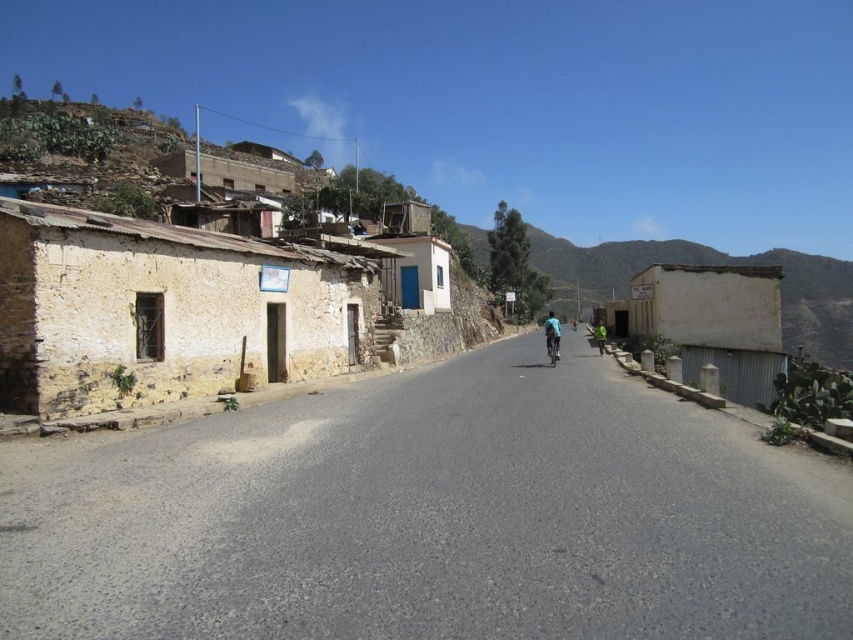
Question: Considering the real-world distances, which object is closest to the yellow stucco wall at left?

Choices:
 (A) blue fabric cyclist at center
 (B) shiny metallic bicycle at center
 (C) green fabric person at center

Answer: (B)

Question: Considering the real-world distances, which object is farthest from the shiny metallic bicycle at center?

Choices:
 (A) yellow stucco wall at left
 (B) green fabric person at center

Answer: (B)

Question: Is yellow stucco wall at left behind green fabric person at center?

Choices:
 (A) yes
 (B) no

Answer: (B)

Question: Among these points, which one is nearest to the camera?

Choices:
 (A) (364, 272)
 (B) (544, 332)
 (C) (602, 326)
 (D) (546, 344)

Answer: (A)

Question: Is blue fabric cyclist at center to the right of green fabric person at center from the viewer's perspective?

Choices:
 (A) no
 (B) yes

Answer: (A)

Question: Does yellow stucco wall at left appear on the left side of green fabric person at center?

Choices:
 (A) yes
 (B) no

Answer: (A)